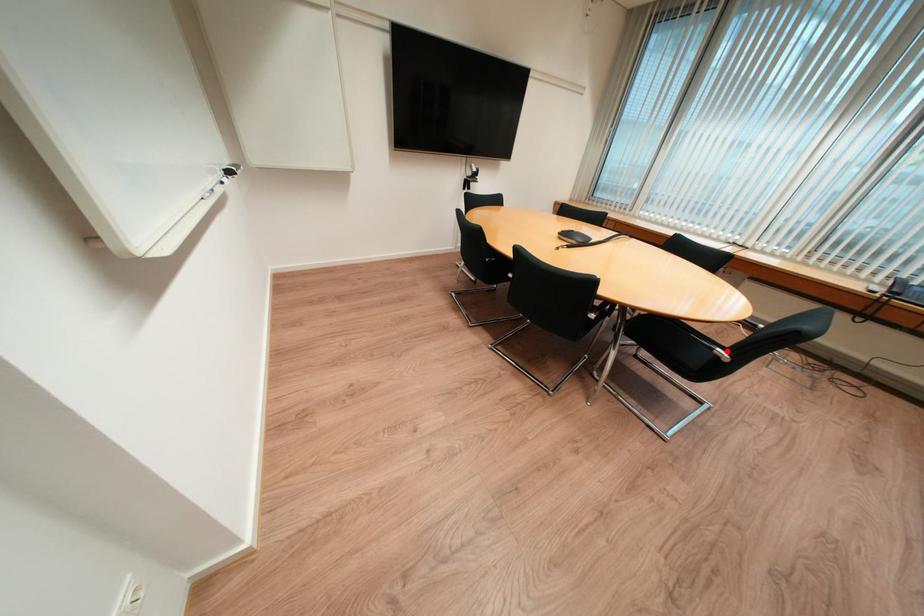
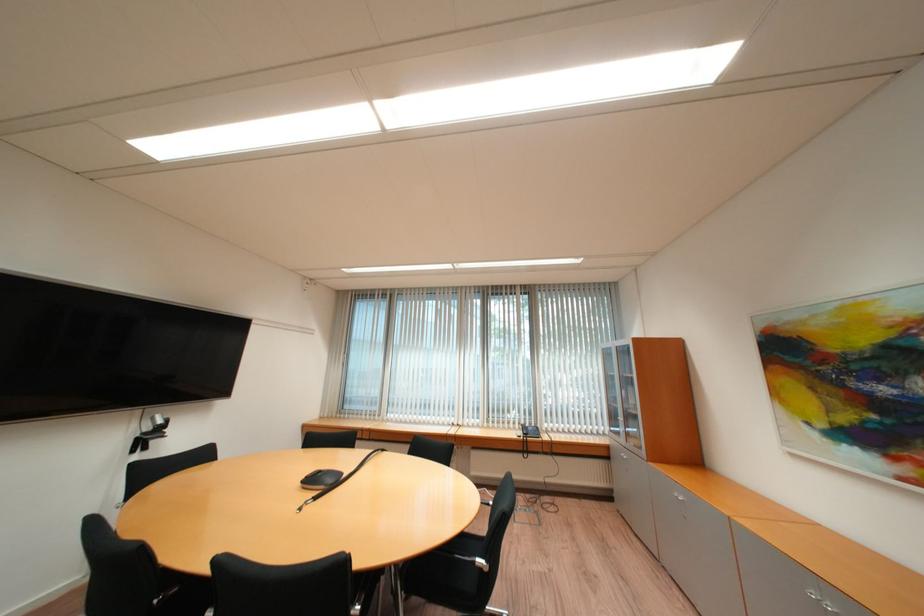
Where in the second image is the point corresponding to the highlighted location from the first image?

(487, 561)